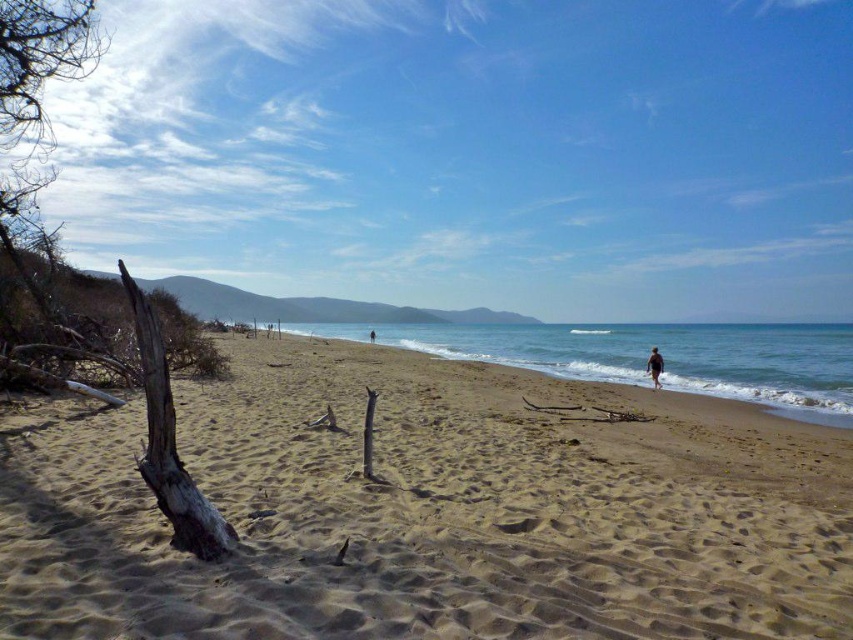
Which is more to the left, light brown sandy beach at center or blue water at beach right?

Positioned to the left is light brown sandy beach at center.

Between light brown sandy beach at center and blue water at beach right, which one has more height?

With more height is blue water at beach right.

Is point (613, 524) more distant than point (844, 326)?

No, (613, 524) is closer to viewer.

Locate an element on the screen. This screenshot has width=853, height=640. light brown sandy beach at center is located at coordinates (428, 512).

Is blue water at beach right wider than brown sand at center?

Indeed, blue water at beach right has a greater width compared to brown sand at center.

Is blue water at beach right to the right of brown sand at center from the viewer's perspective?

Yes, blue water at beach right is to the right of brown sand at center.

Measure the distance between point (x=409, y=339) and camera.

Point (x=409, y=339) is 229.01 feet away from camera.

I want to click on blue water at beach right, so [648, 353].

In the scene shown: Which is more to the right, light brown sandy beach at center or dark brown skin at lower right?

From the viewer's perspective, dark brown skin at lower right appears more on the right side.

Between light brown sandy beach at center and dark brown skin at lower right, which one appears on the left side from the viewer's perspective?

light brown sandy beach at center is more to the left.

You are a GUI agent. You are given a task and a screenshot of the screen. Output one action in this format:
    pyautogui.click(x=<x>, y=<y>)
    Task: Click on the light brown sandy beach at center
    
    Given the screenshot: What is the action you would take?
    pyautogui.click(x=428, y=512)

Identify the location of light brown sandy beach at center. (428, 512).